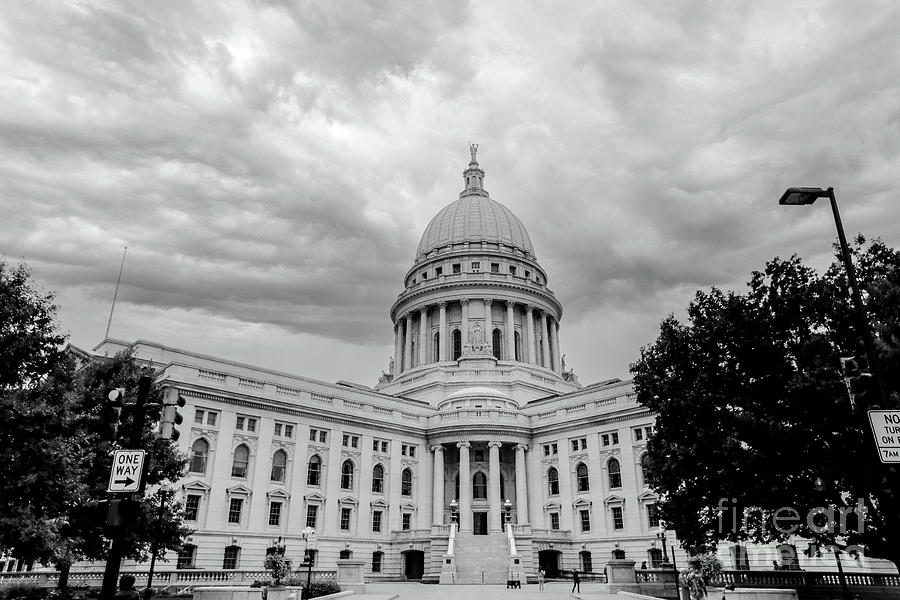
Locate an element on the screen. columns in a rotunda supporting dome is located at coordinates 406,340, 433,338, 448,334, 499,335, 525,337, 551,340.